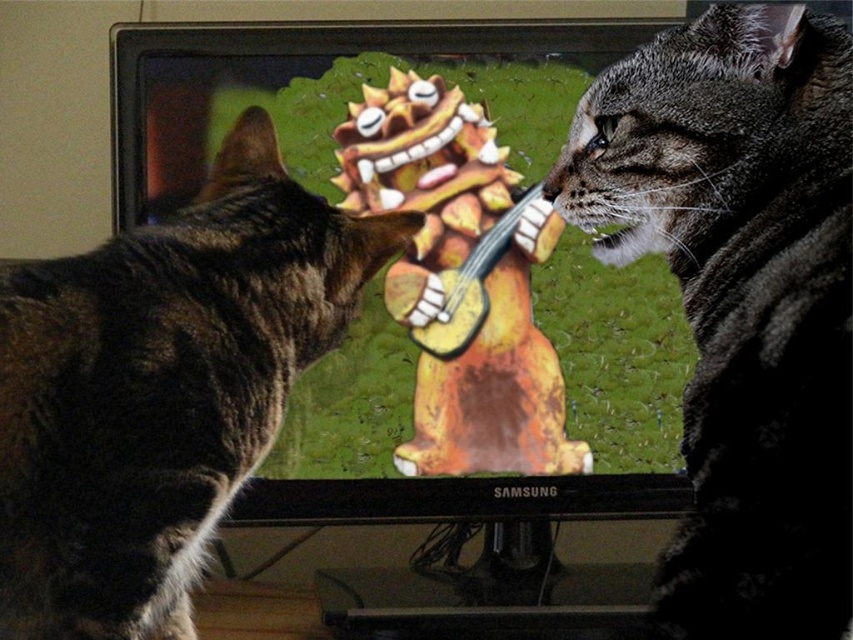
You are a photographer trying to capture a photo of the tabby fur cat at left and the wooden guitar at center. If you want to ensure both subjects are fully visible in the frame, which subject should you focus on to avoid cropping either of them?

The tabby fur cat at left is wider than the wooden guitar at center, so you should focus on the tabby fur cat at left to ensure both fit in the frame without cropping.

You are holding a 12 inch long laser pointer and want to point it at the point at coordinates [808,189]. Can you reach it with your laser pointer?

The point at coordinates [808,189] is 28.26 inches away from the camera, so no, the laser pointer cannot reach it since it is longer than the laser pointer.

You are a photographer trying to capture both cats in a balanced composition. Given that the tabby fur cat at right and the tabby fur cat at left are in the frame, which cat should you move closer to the center to achieve balance?

The tabby fur cat at right occupies less space than the tabby fur cat at left, so you should move the tabby fur cat at right closer to the center to balance the composition.